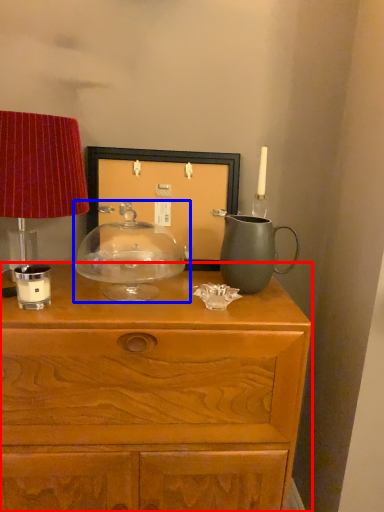
Question: Which object appears farthest to the camera in this image, chest of drawers (highlighted by a red box) or candle holder (highlighted by a blue box)?

Choices:
 (A) chest of drawers
 (B) candle holder

Answer: (B)